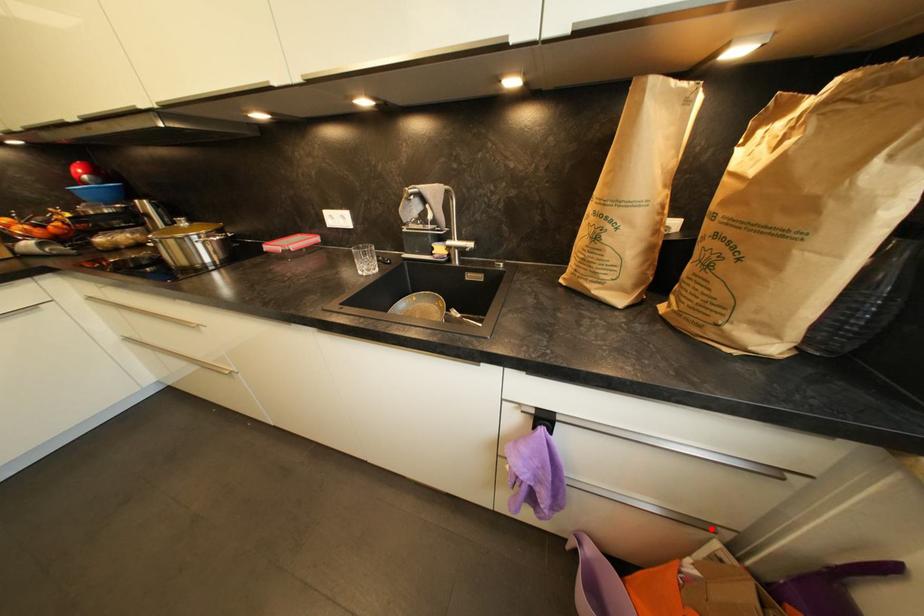
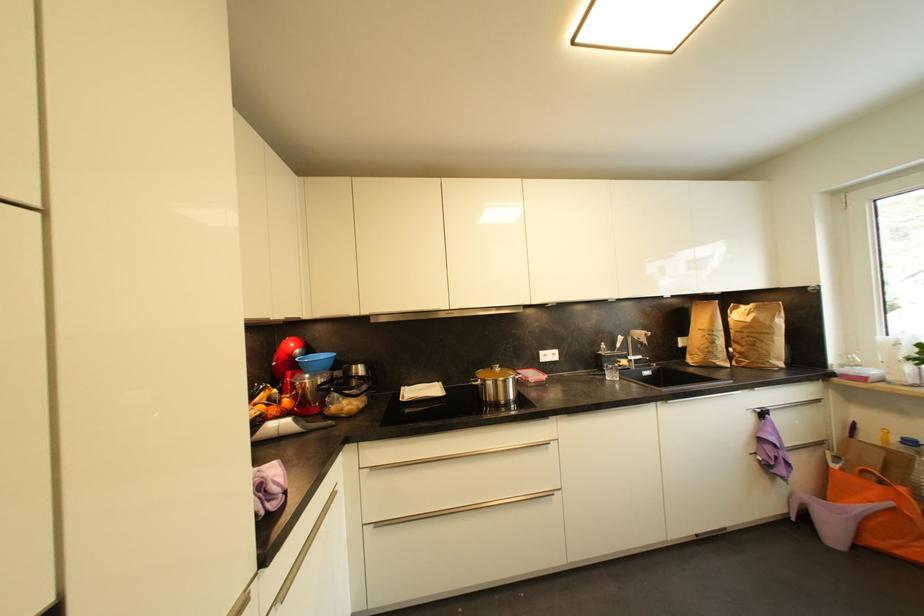
Where in the second image is the point corresponding to the highlighted location from the first image?

(825, 446)